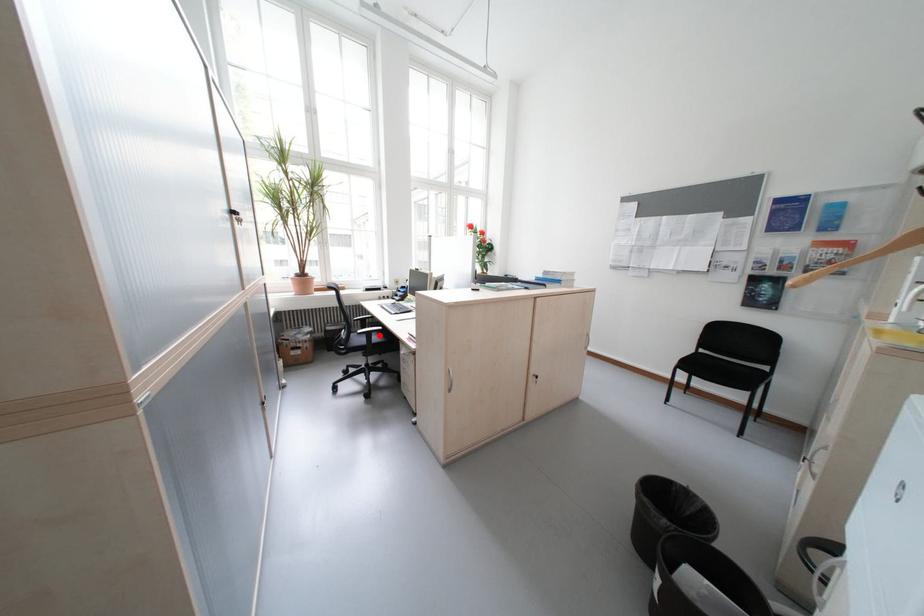
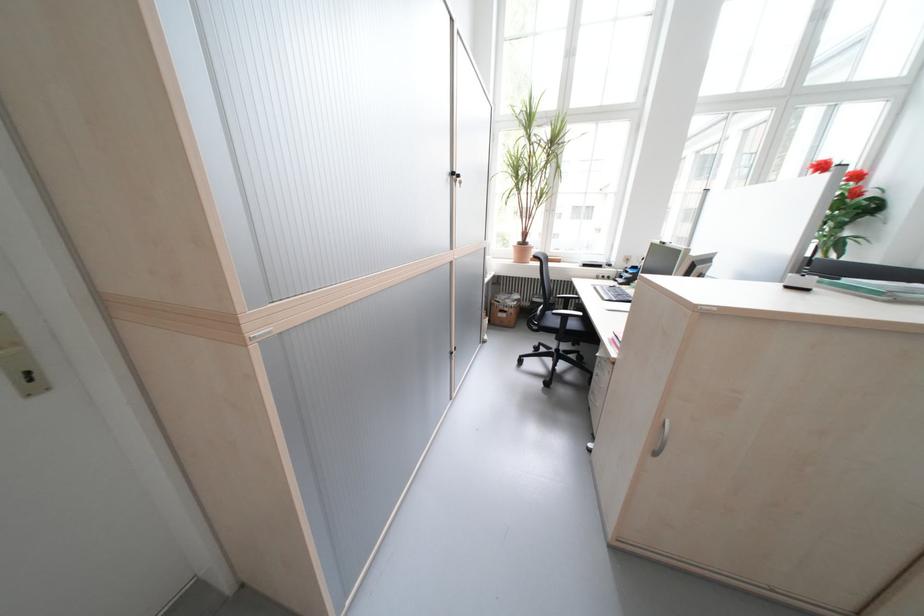
Question: I am providing you with two images of the same scene from different viewpoints. Image1 has a red point marked. In image2, the corresponding 3D location appears at what relative position? Reply with the corresponding letter.

Choices:
 (A) Closer
 (B) Farther

Answer: (A)